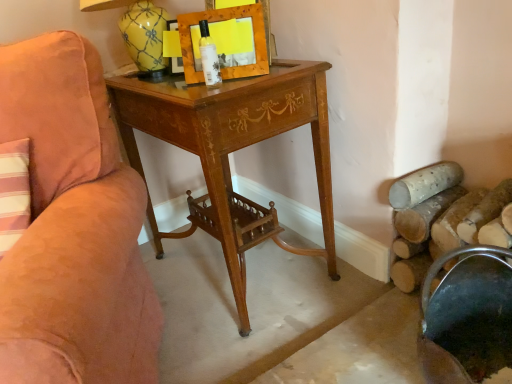
Identify the location of free space to the right of wooden picture frame at upper center. (288, 69).